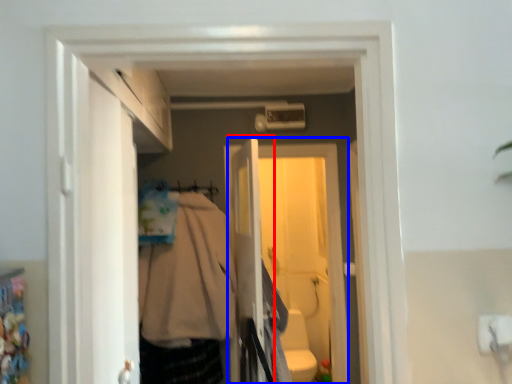
Question: Which of the following is the closest to the observer, screen door (highlighted by a red box) or screen door (highlighted by a blue box)?

Choices:
 (A) screen door
 (B) screen door

Answer: (A)